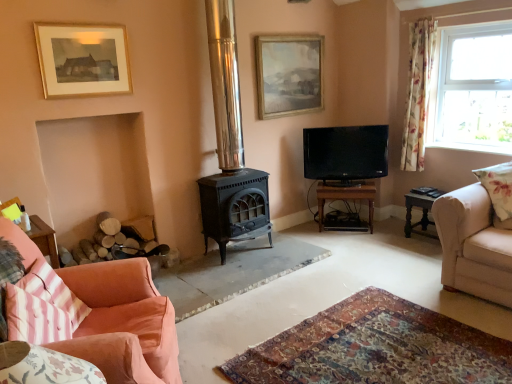
Locate an element on the screen. Image resolution: width=512 pixels, height=384 pixels. floral fabric curtain at right is located at coordinates (418, 93).

Where is `wooden picture frame at upper center, the second picture frame viewed from the front`? wooden picture frame at upper center, the second picture frame viewed from the front is located at coordinates (288, 74).

What do you see at coordinates (422, 214) in the screenshot?
I see `dark gray wooden side table at right, positioned as the second table in left-to-right order` at bounding box center [422, 214].

Locate an element on the screen. black glossy tv at center is located at coordinates (345, 152).

What do you see at coordinates (230, 146) in the screenshot? The height and width of the screenshot is (384, 512). I see `black cast iron stove at center` at bounding box center [230, 146].

Where is `brown wooden table at center, the second table when ordered from right to left`? brown wooden table at center, the second table when ordered from right to left is located at coordinates (346, 198).

How distant is black glossy tv at center from floral fabric curtain at right?

black glossy tv at center is 61.26 centimeters from floral fabric curtain at right.

Between black glossy tv at center and floral fabric curtain at right, which one has more height?

floral fabric curtain at right.

Identify the location of curtain on the right side of black glossy tv at center. (418, 93).

Is black glossy tv at center smaller than floral fabric curtain at right?

No, black glossy tv at center is not smaller than floral fabric curtain at right.

From the image's perspective, who appears lower, pink striped cushion at lower left, the second pillow in the top-to-bottom sequence, or floral fabric curtain at right?

From the image's view, pink striped cushion at lower left, the second pillow in the top-to-bottom sequence, is below.

Is pink striped cushion at lower left, which is the 1th pillow from front to back, not inside floral fabric curtain at right?

Absolutely, pink striped cushion at lower left, which is the 1th pillow from front to back, is external to floral fabric curtain at right.

Considering their positions, is pink striped cushion at lower left, which is the 1th pillow from front to back, located in front of or behind floral fabric curtain at right?

pink striped cushion at lower left, which is the 1th pillow from front to back, is in front of floral fabric curtain at right.

Could you measure the distance between pink fabric couch at lower left, the 2th studio couch in the back-to-front sequence, and clear glass window at upper right?

pink fabric couch at lower left, the 2th studio couch in the back-to-front sequence, and clear glass window at upper right are 11.12 feet apart from each other.

Does point (123, 325) come in front of point (505, 62)?

Yes, it is in front of point (505, 62).

In terms of size, does pink fabric couch at lower left, which is the 1th studio couch from left to right, appear bigger or smaller than clear glass window at upper right?

Considering their sizes, pink fabric couch at lower left, which is the 1th studio couch from left to right, takes up more space than clear glass window at upper right.

Which is in front, point (503, 188) or point (344, 167)?

Point (503, 188)

Is floral fabric cushion at right, the first pillow in the top-to-bottom sequence, facing away from black glossy tv at center?

floral fabric cushion at right, the first pillow in the top-to-bottom sequence, does not have its back to black glossy tv at center.

Looking at this image, can black glossy tv at center be found inside floral fabric cushion at right, the first pillow in the top-to-bottom sequence?

That's incorrect, black glossy tv at center is not inside floral fabric cushion at right, the first pillow in the top-to-bottom sequence.

Is point (172, 374) positioned behind point (228, 117)?

No, (172, 374) is closer to viewer.

Is pink fabric couch at lower left, placed as the 1th studio couch when sorted from front to back, positioned beyond the bounds of black cast iron stove at center?

pink fabric couch at lower left, placed as the 1th studio couch when sorted from front to back, is positioned outside black cast iron stove at center.

Can you confirm if pink fabric couch at lower left, the 2th studio couch in the back-to-front sequence, is thinner than black cast iron stove at center?

No, pink fabric couch at lower left, the 2th studio couch in the back-to-front sequence, is not thinner than black cast iron stove at center.

Is pink fabric couch at lower left, placed as the 1th studio couch when sorted from front to back, oriented away from black cast iron stove at center?

No, black cast iron stove at center is not at the back of pink fabric couch at lower left, placed as the 1th studio couch when sorted from front to back.

Between brown wooden table at center, the first table viewed from the left, and beige fabric couch at right, marked as the second studio couch in a front-to-back arrangement, which one is positioned behind?

brown wooden table at center, the first table viewed from the left, is behind.

From a real-world perspective, is brown wooden table at center, the second table when ordered from right to left, beneath beige fabric couch at right, marked as the second studio couch in a front-to-back arrangement?

Indeed, from a real-world perspective, brown wooden table at center, the second table when ordered from right to left, is positioned beneath beige fabric couch at right, marked as the second studio couch in a front-to-back arrangement.

Considering the relative sizes of brown wooden table at center, the second table when ordered from right to left, and beige fabric couch at right, the 1th studio couch viewed from the back, in the image provided, is brown wooden table at center, the second table when ordered from right to left, thinner than beige fabric couch at right, the 1th studio couch viewed from the back,?

Correct, the width of brown wooden table at center, the second table when ordered from right to left, is less than that of beige fabric couch at right, the 1th studio couch viewed from the back.

Considering the sizes of objects brown wooden table at center, the second table when ordered from right to left, and beige fabric couch at right, which is the first studio couch from right to left, in the image provided, who is smaller, brown wooden table at center, the second table when ordered from right to left, or beige fabric couch at right, which is the first studio couch from right to left,?

brown wooden table at center, the second table when ordered from right to left.

From the image's perspective, does beige fabric couch at right, the 1th studio couch viewed from the back, appear lower than floral fabric cushion at right, the second pillow when ordered from bottom to top?

Yes, from the image's perspective, beige fabric couch at right, the 1th studio couch viewed from the back, is beneath floral fabric cushion at right, the second pillow when ordered from bottom to top.

Between beige fabric couch at right, which is the first studio couch from right to left, and floral fabric cushion at right, which is the first pillow in right-to-left order, which one has smaller width?

floral fabric cushion at right, which is the first pillow in right-to-left order.

Is beige fabric couch at right, marked as the second studio couch in a front-to-back arrangement, facing away from floral fabric cushion at right, the second pillow when ordered from bottom to top?

beige fabric couch at right, marked as the second studio couch in a front-to-back arrangement, is not turned away from floral fabric cushion at right, the second pillow when ordered from bottom to top.

Consider the image. Does beige fabric couch at right, which is the first studio couch from right to left, come in front of floral fabric cushion at right, the first pillow in the back-to-front sequence?

Yes, beige fabric couch at right, which is the first studio couch from right to left, is in front of floral fabric cushion at right, the first pillow in the back-to-front sequence.

I want to click on television that appears behind the floral fabric curtain at right, so click(345, 152).

Where is `pillow on the left side of floral fabric curtain at right`? The image size is (512, 384). pillow on the left side of floral fabric curtain at right is located at coordinates (54, 291).

From the image, which object appears to be farther from black cast iron stove at center, beige fabric couch at right, the 1th studio couch viewed from the back, or floral fabric curtain at right?

Based on the image, floral fabric curtain at right appears to be further to black cast iron stove at center.

Estimate the real-world distances between objects in this image. Which object is further from pink fabric couch at lower left, the 2th studio couch positioned from the right, black glossy tv at center or brown wooden table at center, the second table when ordered from right to left?

brown wooden table at center, the second table when ordered from right to left, is further to pink fabric couch at lower left, the 2th studio couch positioned from the right.

From the picture: Considering their positions, is wooden picture frame at upper center, the second picture frame viewed from the front, positioned closer to black glossy tv at center than floral fabric cushion at right, the first pillow in the back-to-front sequence?

wooden picture frame at upper center, the second picture frame viewed from the front.

When comparing their distances from floral fabric curtain at right, does beige fabric couch at right, which is the first studio couch from right to left, or brown wooden table at center, the second table when ordered from right to left, seem further?

beige fabric couch at right, which is the first studio couch from right to left.

Based on their spatial positions, is black cast iron stove at center or wooden picture frame at upper center, the second picture frame when ordered from left to right, closer to pink fabric couch at lower left, the 2th studio couch positioned from the right?

black cast iron stove at center is positioned closer to the anchor pink fabric couch at lower left, the 2th studio couch positioned from the right.

Estimate the real-world distances between objects in this image. Which object is further from black glossy tv at center, clear glass window at upper right or pink fabric couch at lower left, placed as the 1th studio couch when sorted from front to back?

pink fabric couch at lower left, placed as the 1th studio couch when sorted from front to back.

Looking at the image, which one is located further to pink striped cushion at lower left, which is the 1th pillow from front to back, black glossy tv at center or clear glass window at upper right?

clear glass window at upper right.

Based on their spatial positions, is black cast iron stove at center or floral fabric cushion at right, the first pillow in the top-to-bottom sequence, closer to beige fabric couch at right, arranged as the second studio couch when viewed from the left?

floral fabric cushion at right, the first pillow in the top-to-bottom sequence, is positioned closer to the anchor beige fabric couch at right, arranged as the second studio couch when viewed from the left.

At what (x,y) coordinates should I click in order to perform the action: click on studio couch situated between wooden picture frame at upper center, which is the 1th picture frame in right-to-left order, and floral fabric cushion at right, which ranks as the 2th pillow in left-to-right order, from left to right. Please return your answer as a coordinate pair (x, y). The width and height of the screenshot is (512, 384). Looking at the image, I should click on (474, 245).

Where is `window between floral fabric cushion at right, the first pillow in the back-to-front sequence, and brown wooden table at center, the second table when ordered from right to left, along the z-axis`? This screenshot has width=512, height=384. window between floral fabric cushion at right, the first pillow in the back-to-front sequence, and brown wooden table at center, the second table when ordered from right to left, along the z-axis is located at coordinates (472, 88).

Locate an element on the screen. This screenshot has width=512, height=384. curtain between black glossy tv at center and clear glass window at upper right in the horizontal direction is located at coordinates tap(418, 93).

This screenshot has width=512, height=384. I want to click on fireplace between pink striped cushion at lower left, which appears as the first pillow when viewed from the left, and beige fabric couch at right, arranged as the second studio couch when viewed from the left, from left to right, so click(x=230, y=146).